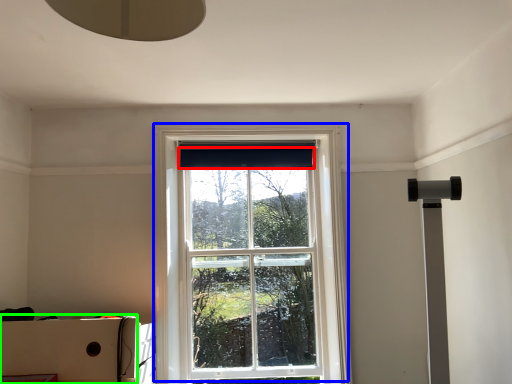
Question: Considering the real-world distances, which object is closest to curtain (highlighted by a red box)? window (highlighted by a blue box) or cardboard box (highlighted by a green box).

Choices:
 (A) window
 (B) cardboard box

Answer: (A)